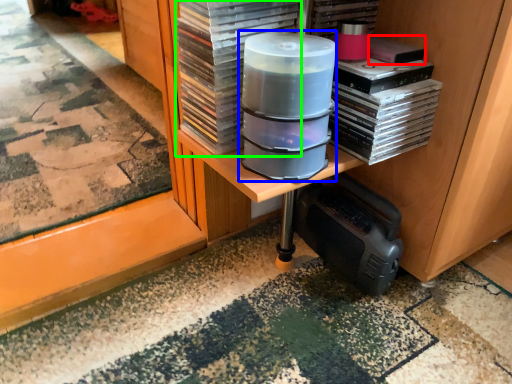
Question: Which is nearer to the paperback book (highlighted by a red box)? appliance (highlighted by a blue box) or paperback book (highlighted by a green box).

Choices:
 (A) appliance
 (B) paperback book

Answer: (A)